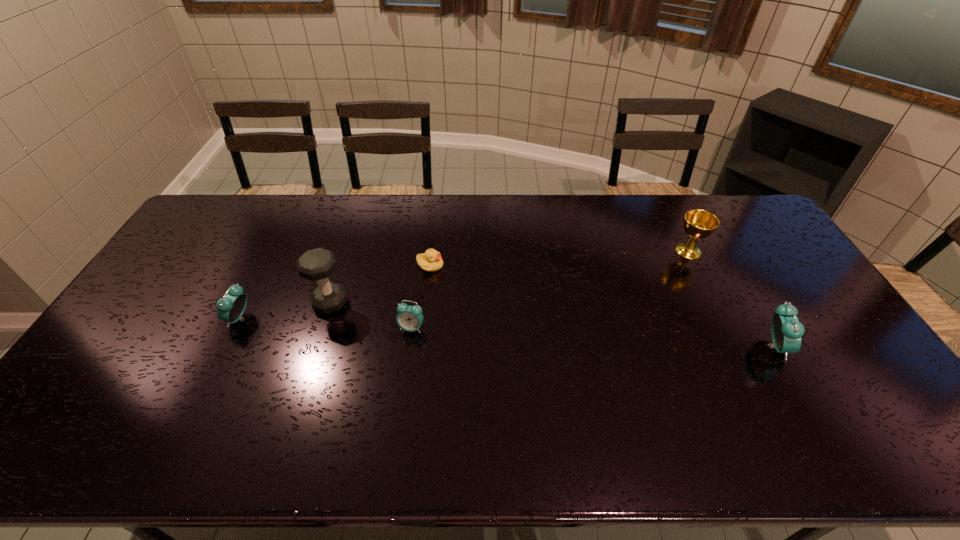
What are the coordinates of `vacant space situated 0.120m on the face of the leftmost object` in the screenshot? It's located at (188, 319).

You are a GUI agent. You are given a task and a screenshot of the screen. Output one action in this format:
    pyautogui.click(x=<x>, y=<y>)
    Task: Click on the vacant point located 0.160m on the face of the leftmost object
    The height and width of the screenshot is (540, 960).
    Given the screenshot: What is the action you would take?
    pyautogui.click(x=175, y=319)

Locate an element on the screen. vacant area situated 0.310m on the face of the leftmost object is located at coordinates (123, 319).

Identify the location of vacant space situated on the face of the shortest alarm clock. The image size is (960, 540). (407, 362).

In order to click on vacant position located on the face of the rightmost alarm clock in this screenshot , I will do `click(817, 347)`.

Image resolution: width=960 pixels, height=540 pixels. Find the location of `free location located on the right of the chalice`. free location located on the right of the chalice is located at coordinates (780, 251).

This screenshot has height=540, width=960. Find the location of `vacant space located 0.110m on the front of the tallest object`. vacant space located 0.110m on the front of the tallest object is located at coordinates (316, 348).

Where is `free spot located at the face of the duckling`? Image resolution: width=960 pixels, height=540 pixels. free spot located at the face of the duckling is located at coordinates (498, 265).

You are a GUI agent. You are given a task and a screenshot of the screen. Output one action in this format:
    pyautogui.click(x=<x>, y=<y>)
    Task: Click on the vacant space at the far edge
    The width and height of the screenshot is (960, 540).
    Given the screenshot: What is the action you would take?
    click(440, 231)

Find the location of a particular element. free location at the near edge of the desktop is located at coordinates (673, 401).